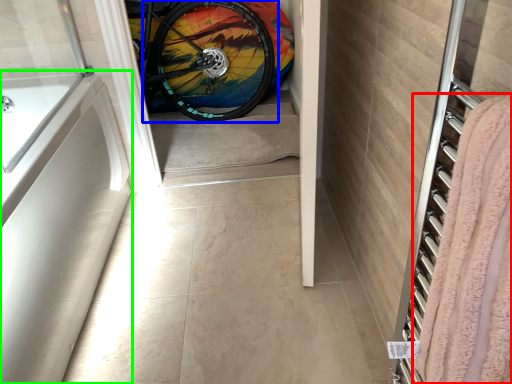
Question: Which is farther away from blanket (highlighted by a red box)? bicycle wheel (highlighted by a blue box) or bath (highlighted by a green box)?

Choices:
 (A) bicycle wheel
 (B) bath

Answer: (A)